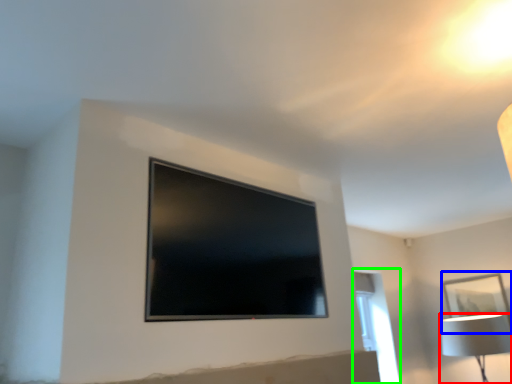
Question: Considering the real-world distances, which object is closest to lamp (highlighted by a red box)? picture frame (highlighted by a blue box) or window (highlighted by a green box).

Choices:
 (A) picture frame
 (B) window

Answer: (A)